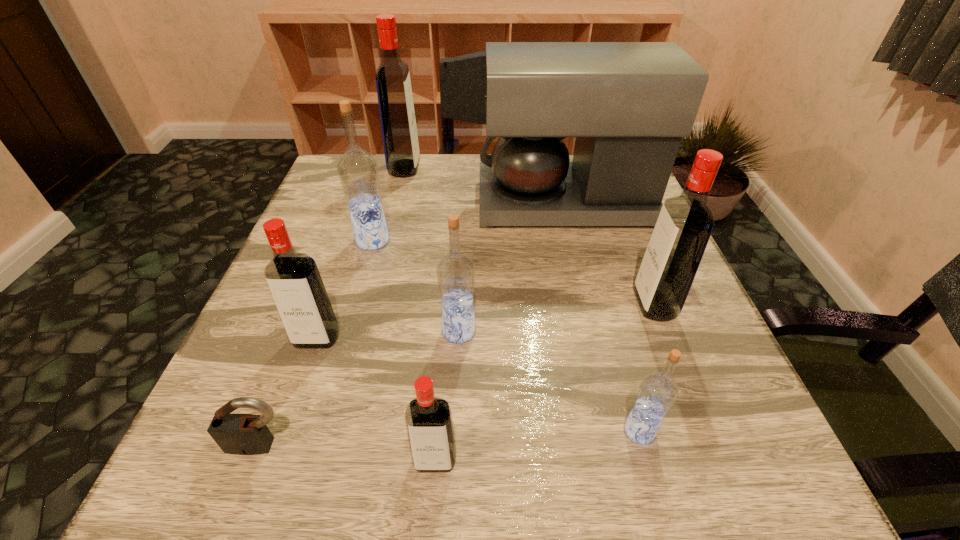
Find the location of a particular element. The height and width of the screenshot is (540, 960). free space that satisfies the following two spatial constraints: 1. on the front and back of the rightmost vodka; 2. on the front side of the second blue vodka from right to left is located at coordinates (664, 331).

You are a GUI agent. You are given a task and a screenshot of the screen. Output one action in this format:
    pyautogui.click(x=<x>, y=<y>)
    Task: Click on the free location that satisfies the following two spatial constraints: 1. on the front and back of the third nearest red vodka; 2. on the front and back of the third biggest red vodka
    
    Given the screenshot: What is the action you would take?
    pyautogui.click(x=667, y=339)